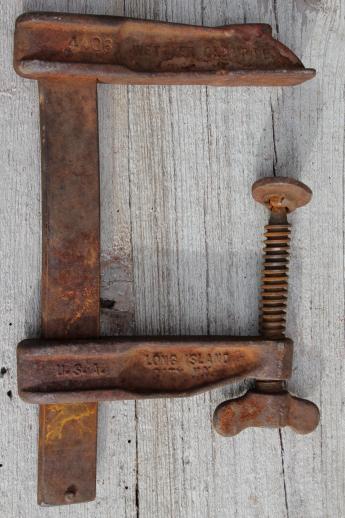
Identify the location of wooden boards. (112, 196), (222, 154), (309, 120).